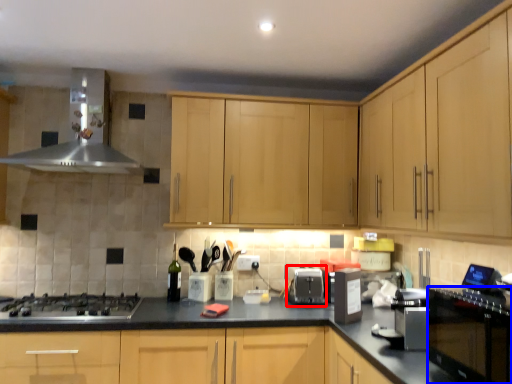
Question: Which point is further to the camera, appliance (highlighted by a red box) or oven (highlighted by a blue box)?

Choices:
 (A) appliance
 (B) oven

Answer: (A)